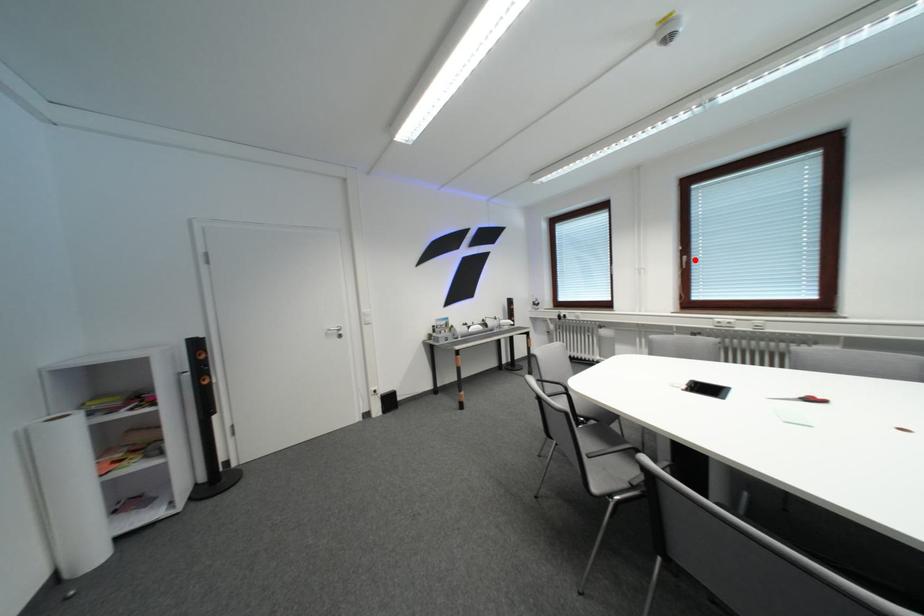
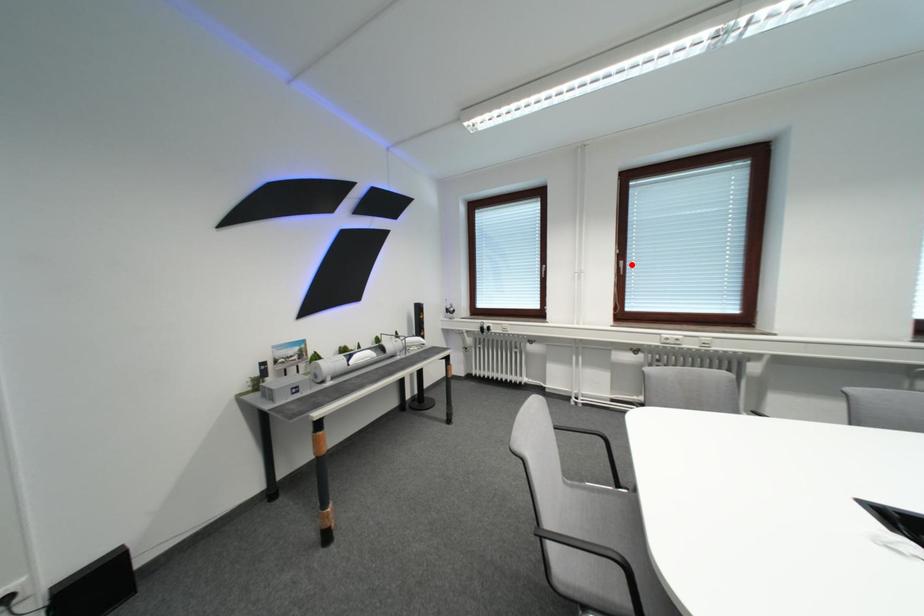
I am providing you with two images of the same scene from different viewpoints. A red point is marked on the first image and another point is marked on the second image. Are the points marked in image1 and image2 representing the same 3D position?

Yes